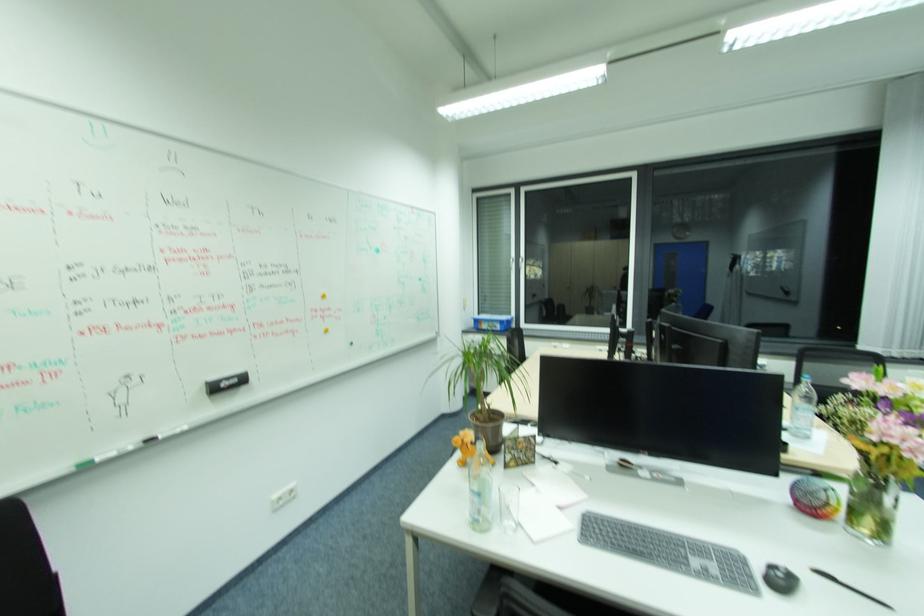
Find where to rest the chair armrest. Please return your answer as a coordinate pair (x, y).

(703, 342)